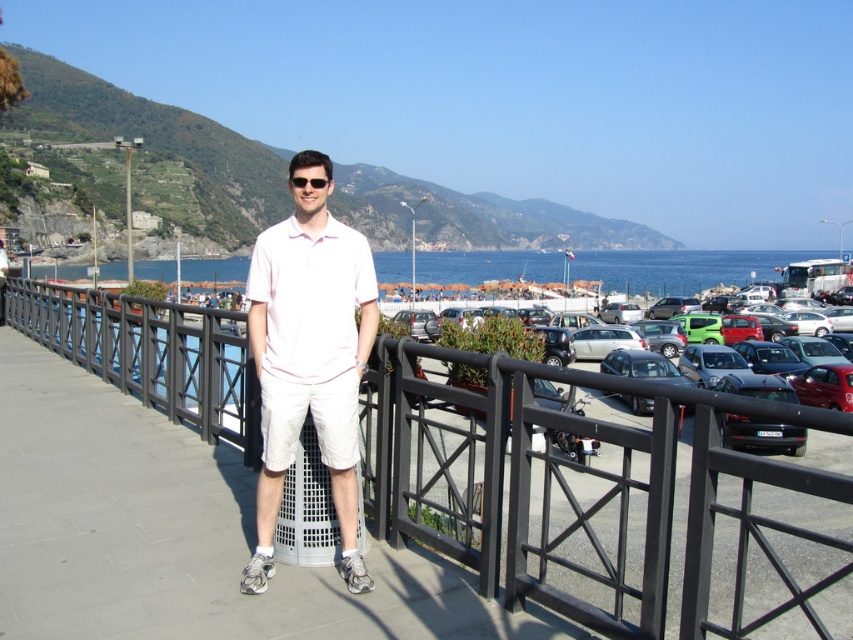
Is black metal fence at center below white cotton shirt at center?

Indeed, black metal fence at center is positioned under white cotton shirt at center.

Is black metal fence at center to the right of white cotton shirt at center from the viewer's perspective?

Correct, you'll find black metal fence at center to the right of white cotton shirt at center.

Identify the location of black metal fence at center. The height and width of the screenshot is (640, 853). (606, 502).

Between black metal fence at center and blue water at center, which one has less height?

With less height is black metal fence at center.

Which is above, black metal fence at center or blue water at center?

Positioned higher is blue water at center.

Between point (805, 577) and point (598, 266), which one is positioned behind?

Positioned behind is point (598, 266).

This screenshot has width=853, height=640. Identify the location of black metal fence at center. (606, 502).

Between white cotton shirt at center and blue water at center, which one appears on the left side from the viewer's perspective?

From the viewer's perspective, white cotton shirt at center appears more on the left side.

Can you confirm if white cotton shirt at center is positioned above blue water at center?

No, white cotton shirt at center is not above blue water at center.

Which is in front, point (252, 288) or point (169, 269)?

Positioned in front is point (252, 288).

You are a GUI agent. You are given a task and a screenshot of the screen. Output one action in this format:
    pyautogui.click(x=<x>, y=<y>)
    Task: Click on the white cotton shirt at center
    The image size is (853, 640).
    Given the screenshot: What is the action you would take?
    pyautogui.click(x=309, y=356)